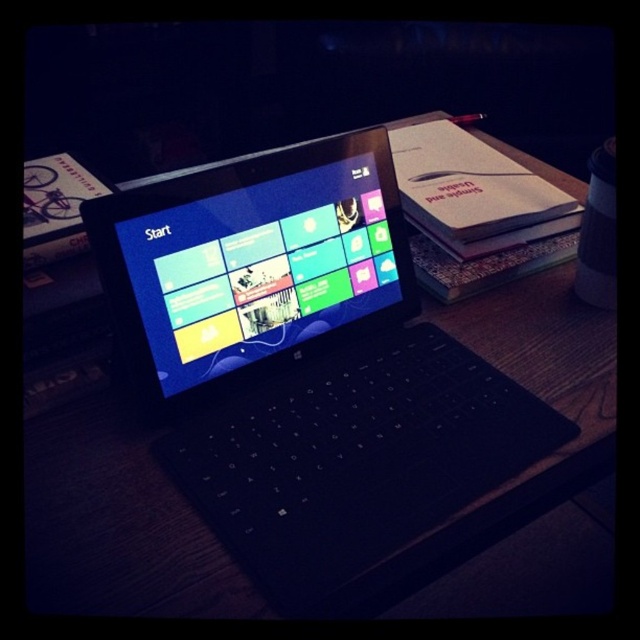
You are setting up a new monitor for your desk. You have a black matte laptop at center and a matte plastic screen at center. Which one is taller so that it can serve as the main display?

The black matte laptop at center is taller than the matte plastic screen at center, so it can serve as the main display.

You are trying to place a new monitor next to your setup. The new monitor has a width of 18 inches. The black matte laptop at center currently occupies space on the desk. Can the matte plastic screen at center fit alongside the new monitor without overlapping?

The black matte laptop at center is wider than the matte plastic screen at center. Since the laptop is wider, the matte plastic screen at center would likely fit alongside the new 18 inch monitor without overlapping, provided there is enough desk space.

You are a student trying to take notes on your black matte laptop at center. You notice the matte plastic screen at center is blocking your view. Is the laptop above or below the screen?

The black matte laptop at center is located below the matte plastic screen at center, so the laptop is below the screen.